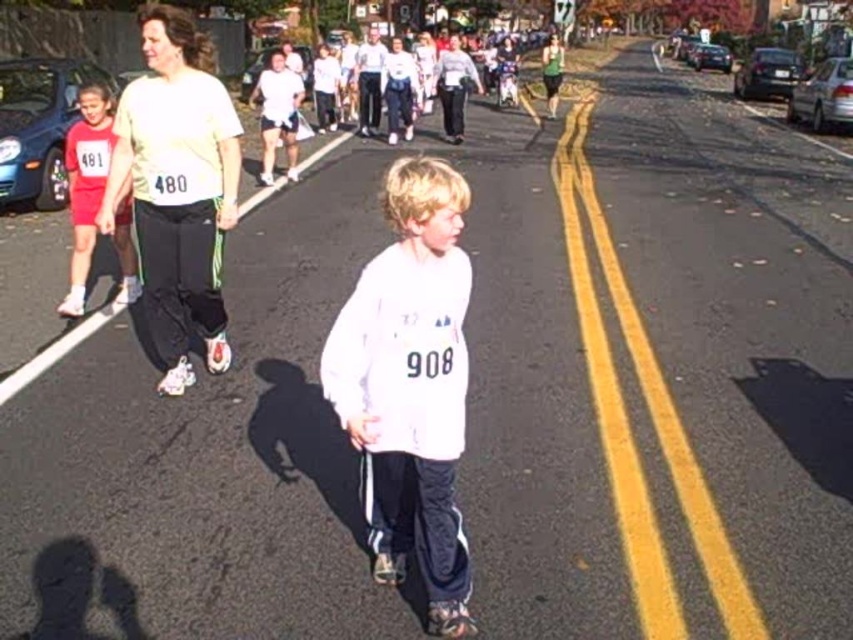
You are a photographer at the event and want to take a photo that includes both the white matte shirt at center and the matte red shorts at left. Based on their positions, which one should you position on the right side of the frame to include both?

To include both the white matte shirt at center and the matte red shorts at left in the photo, you should position the white matte shirt at center on the right side of the frame since it is already to the right of the matte red shorts at left.

You are a participant in the race and you see the white matte shirt at center and the matte white shirt at left. Which one is positioned to the right?

The white matte shirt at center is positioned to the right of the matte white shirt at left.

From the picture: You are standing at the starting line of the race and looking towards the finish line. There is a runner wearing a matte white shirt at left. Where is the runner located relative to the starting line?

The runner wearing the matte white shirt at left is positioned at coordinates point (177, 188) relative to the starting line.